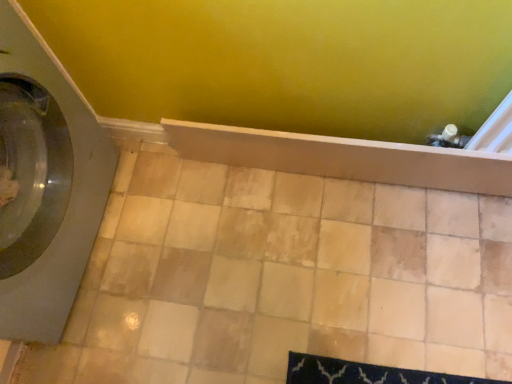
The image size is (512, 384). I want to click on vacant space in wooden shelf at center (from a real-world perspective), so click(x=339, y=179).